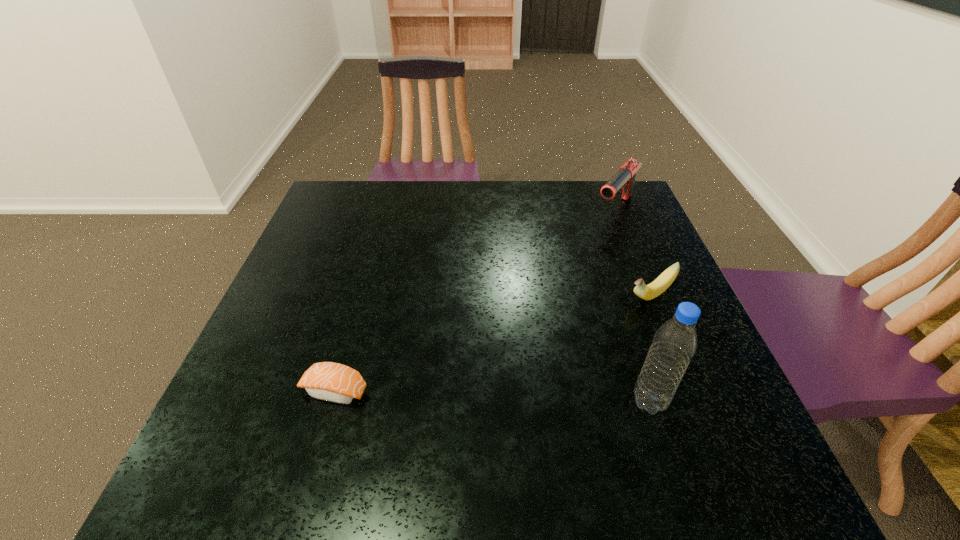
You are a GUI agent. You are given a task and a screenshot of the screen. Output one action in this format:
    pyautogui.click(x=<x>, y=<y>)
    Task: Click on the vacant space located at the stem of the second farthest object
    This screenshot has width=960, height=540.
    Given the screenshot: What is the action you would take?
    pyautogui.click(x=566, y=357)

Find the location of a particular element. vacant area situated 0.120m at the stem of the second farthest object is located at coordinates (598, 333).

Find the location of a particular element. Image resolution: width=960 pixels, height=540 pixels. free space located at the aiming end of the gun is located at coordinates (535, 308).

You are a GUI agent. You are given a task and a screenshot of the screen. Output one action in this format:
    pyautogui.click(x=<x>, y=<y>)
    Task: Click on the vacant region located 0.140m at the aiming end of the gun
    Image resolution: width=960 pixels, height=540 pixels.
    Given the screenshot: What is the action you would take?
    pyautogui.click(x=584, y=251)

At what (x,y) coordinates should I click in order to perform the action: click on free region located 0.200m at the aiming end of the gun. Please return your answer as a coordinate pair (x, y). The width and height of the screenshot is (960, 540). Looking at the image, I should click on (574, 262).

Image resolution: width=960 pixels, height=540 pixels. I want to click on object that is at the far edge, so click(624, 179).

Find the location of a particular element. This screenshot has width=960, height=540. sushi at the near edge is located at coordinates (329, 381).

Find the location of a particular element. water bottle located in the near edge section of the desktop is located at coordinates (675, 342).

I want to click on object that is positioned at the left edge, so (x=329, y=381).

Locate an element on the screen. The image size is (960, 540). water bottle located at the right edge is located at coordinates coord(675,342).